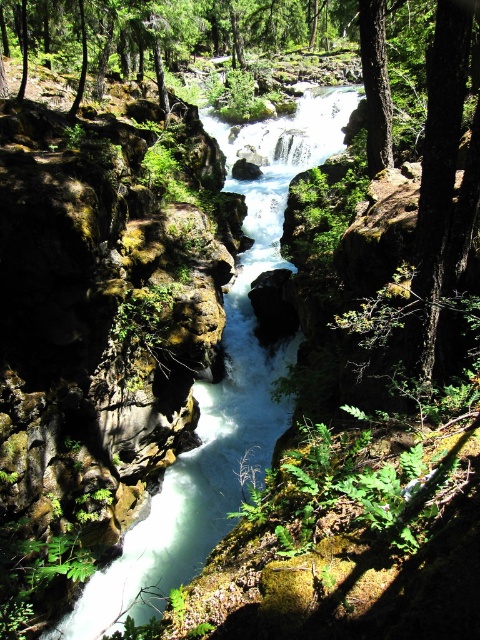
Question: Where is white smooth stream at center located in relation to smooth dark brown tree trunk at upper center in the image?

Choices:
 (A) right
 (B) left

Answer: (B)

Question: Which point is closer to the camera?

Choices:
 (A) (190, 492)
 (B) (377, 44)

Answer: (B)

Question: Does white smooth stream at center have a smaller size compared to smooth dark brown tree trunk at upper center?

Choices:
 (A) no
 (B) yes

Answer: (A)

Question: Which object appears closest to the camera in this image?

Choices:
 (A) smooth dark brown tree trunk at upper center
 (B) white smooth stream at center

Answer: (B)

Question: Which of the following is the closest to the observer?

Choices:
 (A) smooth dark brown tree trunk at upper center
 (B) white smooth stream at center

Answer: (B)

Question: Is white smooth stream at center thinner than smooth dark brown tree trunk at upper center?

Choices:
 (A) yes
 (B) no

Answer: (B)